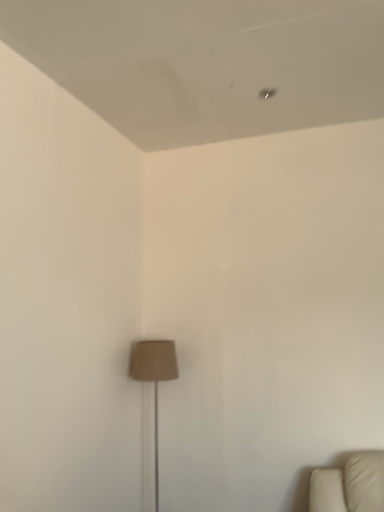
Describe the element at coordinates (154, 377) in the screenshot. I see `beige fabric lampshade at center` at that location.

Find the location of a particular element. beige fabric lampshade at center is located at coordinates (154, 377).

Where is `beige fabric lampshade at center`? This screenshot has width=384, height=512. beige fabric lampshade at center is located at coordinates (154, 377).